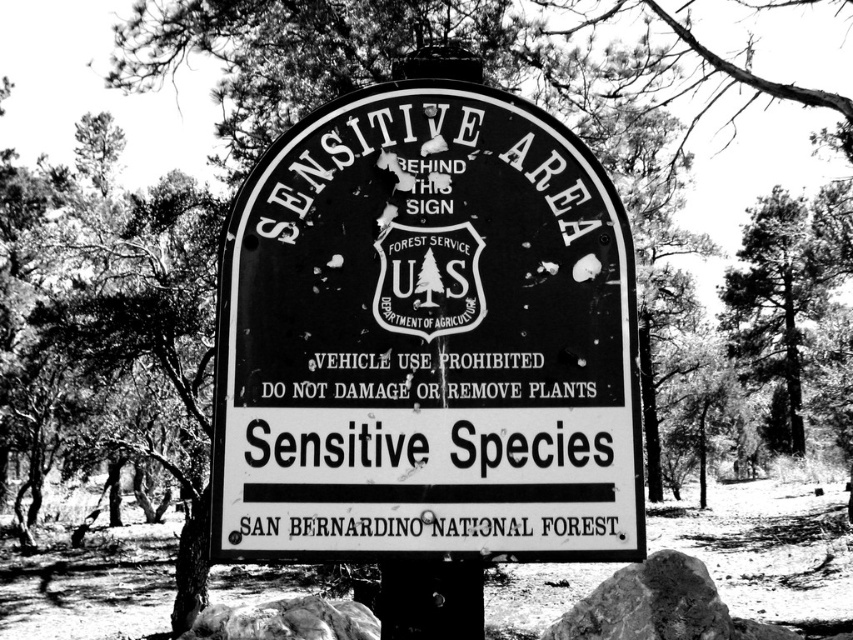
Question: Is black metal sign at center above smooth gray rock at lower center?

Choices:
 (A) no
 (B) yes

Answer: (B)

Question: Is black metal sign at center positioned in front of smooth rock at lower right?

Choices:
 (A) yes
 (B) no

Answer: (A)

Question: Can you confirm if black metal sign at center is positioned below black paper text at lower center?

Choices:
 (A) yes
 (B) no

Answer: (B)

Question: Estimate the real-world distances between objects in this image. Which object is farther from the smooth gray rock at lower center?

Choices:
 (A) dark green textured tree at right
 (B) smooth rock at lower right
 (C) black metal sign at center
 (D) black paper text at lower center

Answer: (A)

Question: Among these points, which one is farthest from the camera?

Choices:
 (A) (183, 637)
 (B) (792, 323)
 (C) (358, 392)

Answer: (B)

Question: Which object appears farthest from the camera in this image?

Choices:
 (A) smooth gray rock at lower center
 (B) black metal sign at center

Answer: (A)